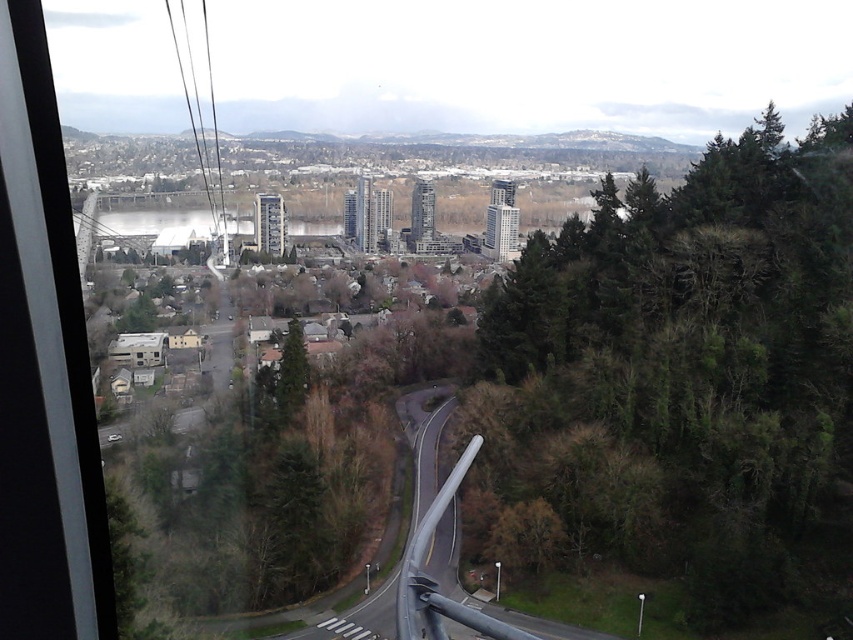
Question: Which point is closer to the camera?

Choices:
 (A) green matte tree at center
 (B) green leafy trees at right

Answer: (B)

Question: Can you confirm if green leafy trees at right is positioned below green matte tree at center?

Choices:
 (A) no
 (B) yes

Answer: (A)

Question: Which point is closer to the camera taking this photo?

Choices:
 (A) (289, 356)
 (B) (526, 280)

Answer: (B)

Question: Is green leafy trees at right below green matte tree at center?

Choices:
 (A) no
 (B) yes

Answer: (A)

Question: Does green leafy trees at right lie behind green matte tree at center?

Choices:
 (A) yes
 (B) no

Answer: (B)